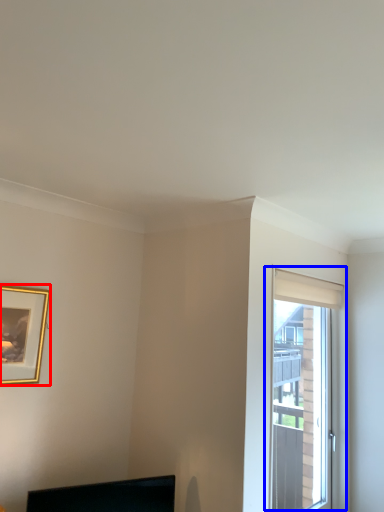
Question: Which of the following is the farthest to the observer, picture frame (highlighted by a red box) or window (highlighted by a blue box)?

Choices:
 (A) picture frame
 (B) window

Answer: (B)